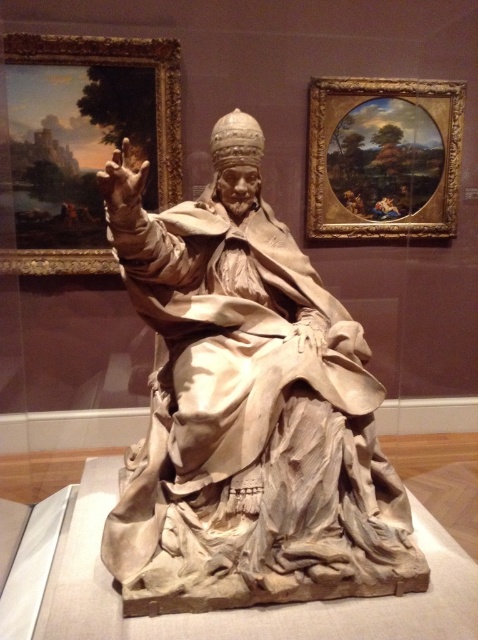
The height and width of the screenshot is (640, 478). Describe the element at coordinates (248, 410) in the screenshot. I see `white marble statue at center` at that location.

Is white marble statue at center smaller than olive green oil painting at upper right?

No.

Who is more forward, (149, 266) or (335, 97)?

Positioned in front is point (149, 266).

This screenshot has height=640, width=478. Find the location of `white marble statue at center`. white marble statue at center is located at coordinates (248, 410).